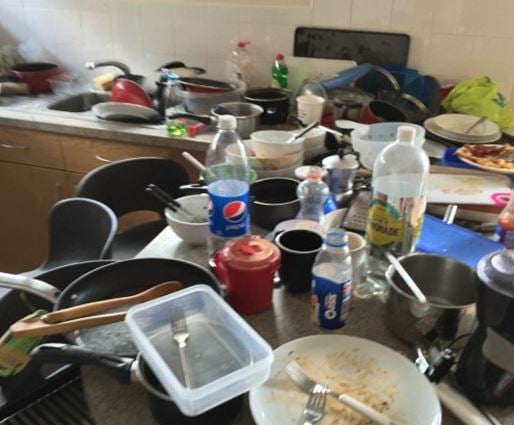
What are the coordinates of `coffee cup` in the screenshot? It's located at (300, 251), (357, 243).